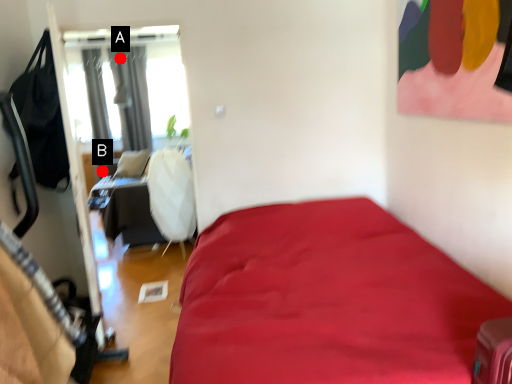
Question: Two points are circled on the image, labeled by A and B beside each circle. Among these points, which one is farthest from the camera?

Choices:
 (A) A is further
 (B) B is further

Answer: (A)